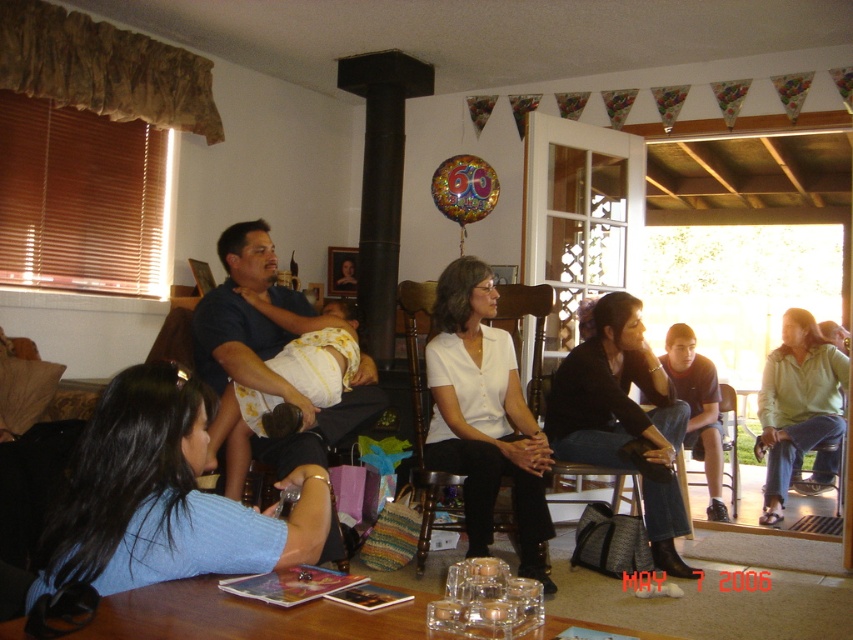
Question: Which of the following is the closest to the observer?

Choices:
 (A) (480, 348)
 (B) (792, 401)
 (C) (193, 380)

Answer: (C)

Question: Which point is farther from the camera taking this photo?

Choices:
 (A) (100, 509)
 (B) (722, 339)
 (C) (579, 333)

Answer: (B)

Question: Which object is the closest to the white smooth shirt at center?

Choices:
 (A) wooden chair at center
 (B) matte white shirt at center

Answer: (B)

Question: Is white smooth shirt at center thinner than wooden chair at center?

Choices:
 (A) yes
 (B) no

Answer: (A)

Question: Where is white smooth shirt at center located in relation to green cotton shirt at lower right in the image?

Choices:
 (A) above
 (B) below

Answer: (A)

Question: Can you confirm if matte white shirt at center is positioned above dark blue shirt at center?

Choices:
 (A) yes
 (B) no

Answer: (B)